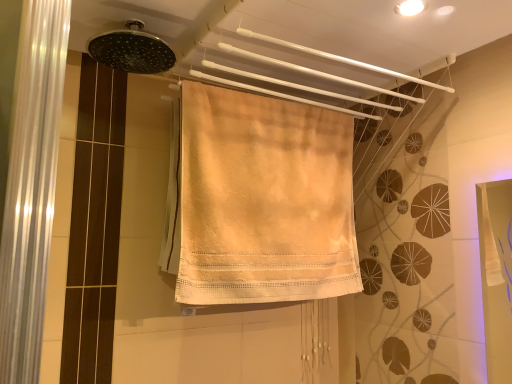
Question: From the image's perspective, is beige cotton towel at center positioned above or below matte black shower head at upper center?

Choices:
 (A) above
 (B) below

Answer: (B)

Question: Considering the relative positions of beige cotton towel at center and matte black shower head at upper center in the image provided, is beige cotton towel at center to the left or to the right of matte black shower head at upper center?

Choices:
 (A) left
 (B) right

Answer: (B)

Question: Considering their positions, is beige cotton towel at center located in front of or behind matte black shower head at upper center?

Choices:
 (A) behind
 (B) front

Answer: (A)

Question: Considering the positions of matte black shower head at upper center and beige cotton towel at center in the image, is matte black shower head at upper center wider or thinner than beige cotton towel at center?

Choices:
 (A) wide
 (B) thin

Answer: (A)

Question: From the image's perspective, relative to beige cotton towel at center, is matte black shower head at upper center above or below?

Choices:
 (A) below
 (B) above

Answer: (B)

Question: Is matte black shower head at upper center taller or shorter than beige cotton towel at center?

Choices:
 (A) short
 (B) tall

Answer: (A)

Question: Which is correct: matte black shower head at upper center is inside beige cotton towel at center, or outside of it?

Choices:
 (A) outside
 (B) inside

Answer: (A)